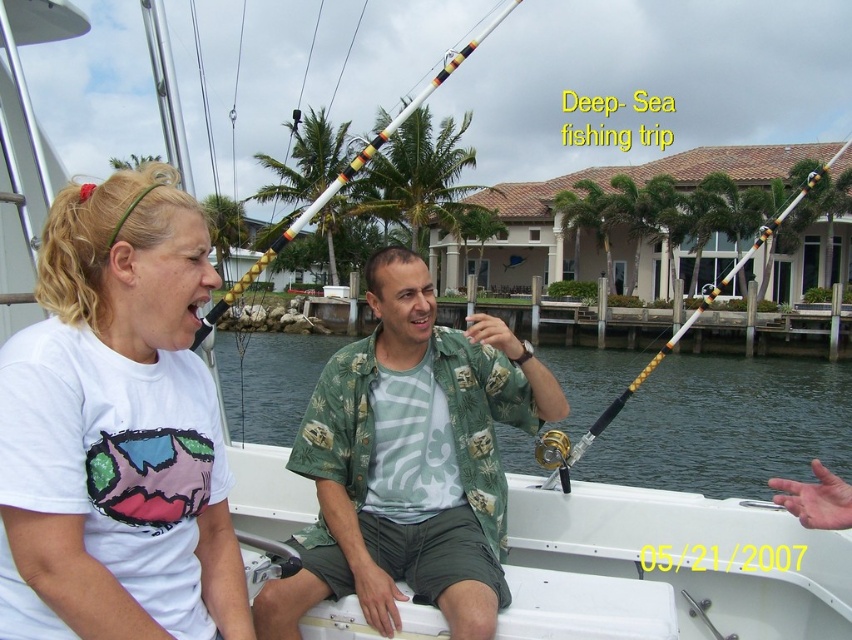
Question: Among these objects, which one is farthest from the camera?

Choices:
 (A) white plastic fishing rod at center
 (B) gold metallic fishing pole at upper center
 (C) green floral shirt at center

Answer: (B)

Question: Which object is positioned closest to the clear water at center?

Choices:
 (A) gold metallic fishing pole at upper center
 (B) white plastic fishing rod at center
 (C) green floral shirt at center
 (D) white matte t-shirt at left

Answer: (A)

Question: Is white plastic fishing rod at center above gold metallic fishing pole at upper center?

Choices:
 (A) yes
 (B) no

Answer: (A)

Question: Is white matte t-shirt at left positioned at the back of green floral shirt at center?

Choices:
 (A) no
 (B) yes

Answer: (A)

Question: Can you confirm if green floral shirt at center is thinner than gold metallic fishing pole at upper center?

Choices:
 (A) yes
 (B) no

Answer: (A)

Question: Which of the following is the closest to the observer?

Choices:
 (A) (730, 269)
 (B) (56, 369)
 (C) (839, 369)

Answer: (B)